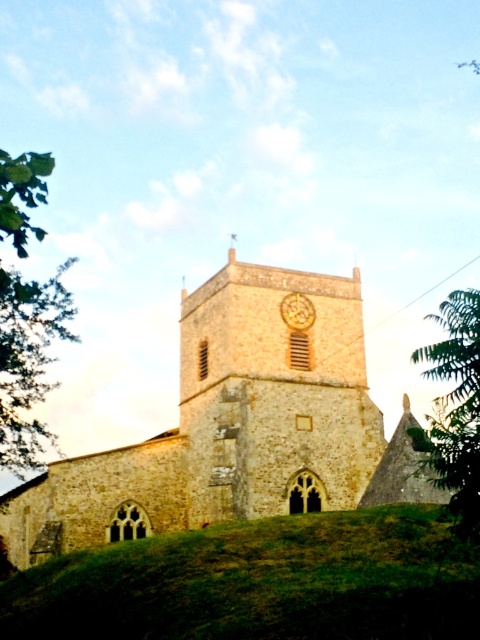
Question: Is green leafy tree at left positioned behind gold textured clock at center?

Choices:
 (A) yes
 (B) no

Answer: (B)

Question: Observing the image, what is the correct spatial positioning of stone clock tower at center in reference to gold textured clock at center?

Choices:
 (A) right
 (B) left

Answer: (B)

Question: Which of these objects is positioned farthest from the stone clock tower at center?

Choices:
 (A) gold textured clock at center
 (B) green leafy tree at right
 (C) brown stone church at center

Answer: (B)

Question: Which of these objects is positioned farthest from the brown stone church at center?

Choices:
 (A) green grassy hill at lower center
 (B) green leafy tree at left
 (C) stone clock tower at center

Answer: (B)

Question: Can you confirm if green leafy tree at left is bigger than gold textured clock at center?

Choices:
 (A) no
 (B) yes

Answer: (B)

Question: Which object is the closest to the stone clock tower at center?

Choices:
 (A) green leafy tree at right
 (B) brown stone church at center
 (C) green leafy tree at left

Answer: (B)